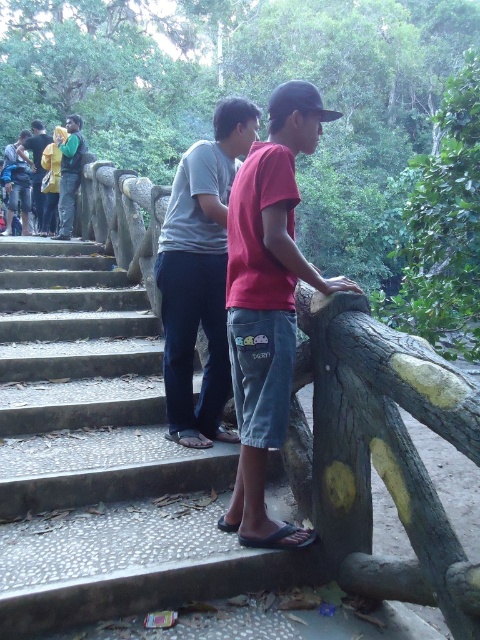
Between gray cotton shirt at center and yellow-green shirt at upper left, which one is positioned lower?

gray cotton shirt at center

Is gray cotton shirt at center positioned before yellow-green shirt at upper left?

Yes.

What are the coordinates of `gray cotton shirt at center` in the screenshot? It's located at (200, 275).

The height and width of the screenshot is (640, 480). Find the location of `gray cotton shirt at center`. gray cotton shirt at center is located at coordinates coord(200,275).

Image resolution: width=480 pixels, height=640 pixels. Describe the element at coordinates (101, 458) in the screenshot. I see `concrete stairs at center` at that location.

Find the location of a particular element. concrete stairs at center is located at coordinates (101, 458).

In order to click on concrete stairs at center in this screenshot , I will do [101, 458].

Is concrete stairs at center positioned behind yellow-green shirt at left?

No, concrete stairs at center is closer to the viewer.

Based on the photo, does concrete stairs at center appear on the right side of yellow-green shirt at left?

Correct, you'll find concrete stairs at center to the right of yellow-green shirt at left.

Who is more forward, (16, 435) or (41, 154)?

Point (16, 435) is more forward.

Identify the location of concrete stairs at center. The image size is (480, 640). (101, 458).